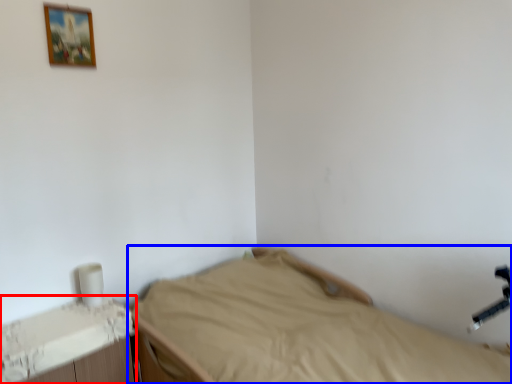
Question: Which object appears farthest to the camera in this image, changing table (highlighted by a red box) or bed (highlighted by a blue box)?

Choices:
 (A) changing table
 (B) bed

Answer: (A)